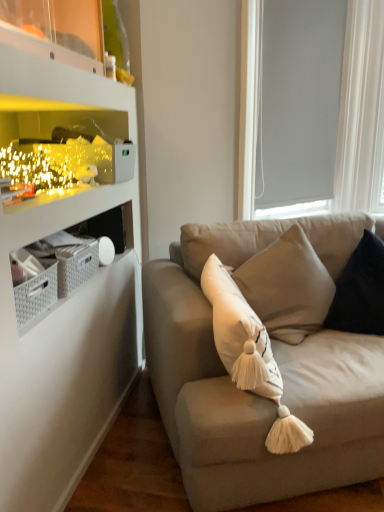
Question: From the image's perspective, is suede beige couch at center over dark blue velvet pillow at right?

Choices:
 (A) no
 (B) yes

Answer: (A)

Question: From a real-world perspective, is suede beige couch at center on dark blue velvet pillow at right?

Choices:
 (A) no
 (B) yes

Answer: (A)

Question: Is suede beige couch at center taller than dark blue velvet pillow at right?

Choices:
 (A) yes
 (B) no

Answer: (A)

Question: Is suede beige couch at center shorter than dark blue velvet pillow at right?

Choices:
 (A) yes
 (B) no

Answer: (B)

Question: Is suede beige couch at center bigger than dark blue velvet pillow at right?

Choices:
 (A) no
 (B) yes

Answer: (B)

Question: Is dark blue velvet pillow at right taller or shorter than suede beige couch at center?

Choices:
 (A) short
 (B) tall

Answer: (A)

Question: Considering the positions of dark blue velvet pillow at right and suede beige couch at center in the image, is dark blue velvet pillow at right wider or thinner than suede beige couch at center?

Choices:
 (A) wide
 (B) thin

Answer: (B)

Question: Is dark blue velvet pillow at right to the left or to the right of suede beige couch at center in the image?

Choices:
 (A) right
 (B) left

Answer: (A)

Question: In the image, is dark blue velvet pillow at right positioned in front of or behind suede beige couch at center?

Choices:
 (A) behind
 (B) front

Answer: (A)

Question: Choose the correct answer: Is white matte window screen at upper right inside dark blue velvet pillow at right or outside it?

Choices:
 (A) outside
 (B) inside

Answer: (A)

Question: From the image's perspective, is white matte window screen at upper right located above or below dark blue velvet pillow at right?

Choices:
 (A) below
 (B) above

Answer: (B)

Question: Would you say white matte window screen at upper right is to the left or to the right of dark blue velvet pillow at right in the picture?

Choices:
 (A) right
 (B) left

Answer: (B)

Question: In the image, is white matte window screen at upper right positioned in front of or behind dark blue velvet pillow at right?

Choices:
 (A) behind
 (B) front

Answer: (A)

Question: Does point (375, 273) appear closer or farther from the camera than point (339, 137)?

Choices:
 (A) farther
 (B) closer

Answer: (B)

Question: Choose the correct answer: Is dark blue velvet pillow at right inside white matte window screen at upper right or outside it?

Choices:
 (A) outside
 (B) inside

Answer: (A)